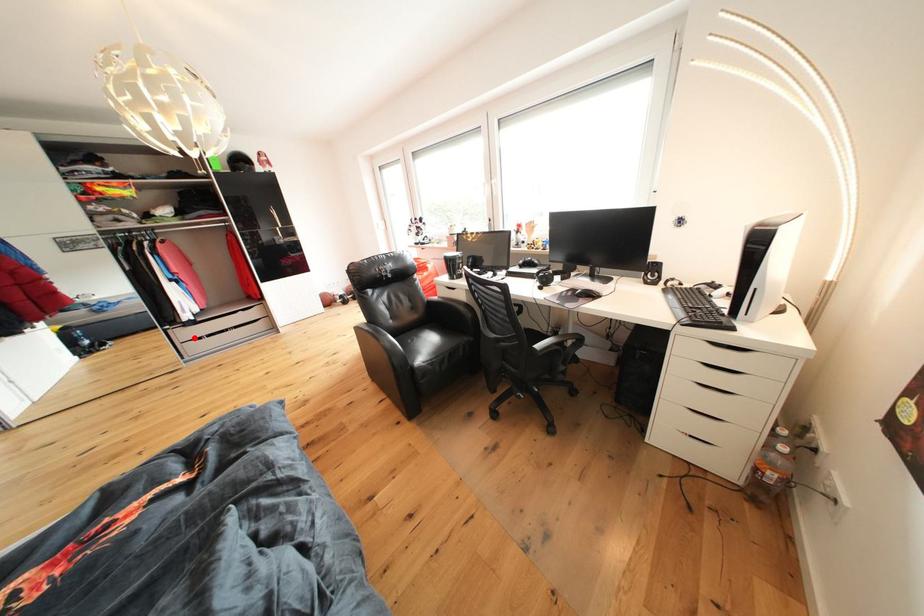
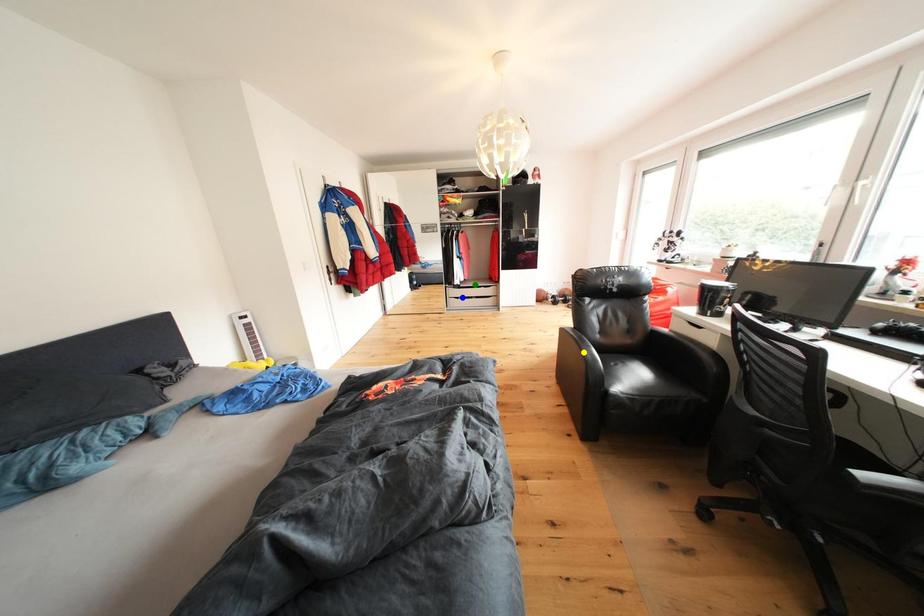
Question: I am providing you with two images of the same scene from different viewpoints. A red point is marked on the first image. You are given multiple points on the second image. Which spot in image 2 lines up with the point in image 1?

Choices:
 (A) yellow point
 (B) blue point
 (C) green point

Answer: (B)